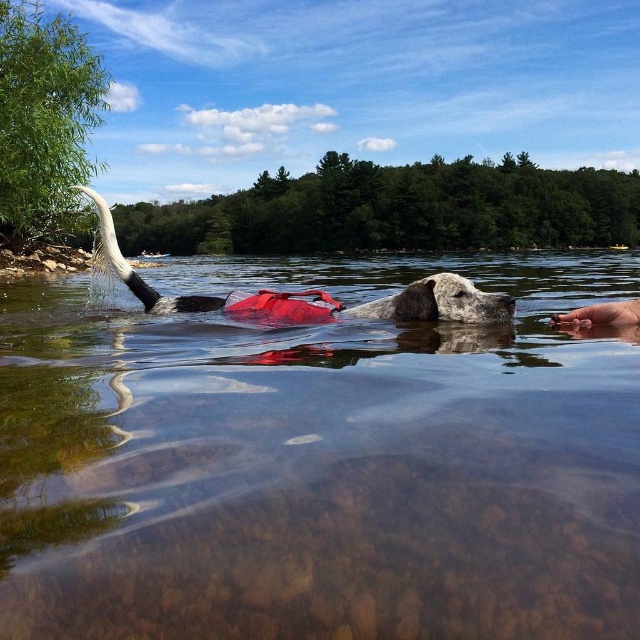
Is gray fur dog at center above smooth skin hand at lower right?

Indeed, gray fur dog at center is positioned over smooth skin hand at lower right.

Does gray fur dog at center lie behind smooth skin hand at lower right?

No, gray fur dog at center is in front of smooth skin hand at lower right.

Where is `gray fur dog at center`? gray fur dog at center is located at coordinates (314, 294).

Find the location of a particular element. The image size is (640, 640). gray fur dog at center is located at coordinates (314, 294).

Does clear water at center have a larger size compared to smooth skin hand at lower right?

Yes, clear water at center is bigger than smooth skin hand at lower right.

Who is more forward, (490, 500) or (566, 314)?

Point (490, 500)

Find the location of a particular element. clear water at center is located at coordinates (321, 464).

Does red rubber life jacket at center appear on the left side of smooth skin hand at lower right?

Yes, red rubber life jacket at center is to the left of smooth skin hand at lower right.

Which is more to the right, red rubber life jacket at center or smooth skin hand at lower right?

From the viewer's perspective, smooth skin hand at lower right appears more on the right side.

Is point (225, 301) positioned behind point (598, 310)?

That is True.

This screenshot has height=640, width=640. Identify the location of red rubber life jacket at center. [284, 307].